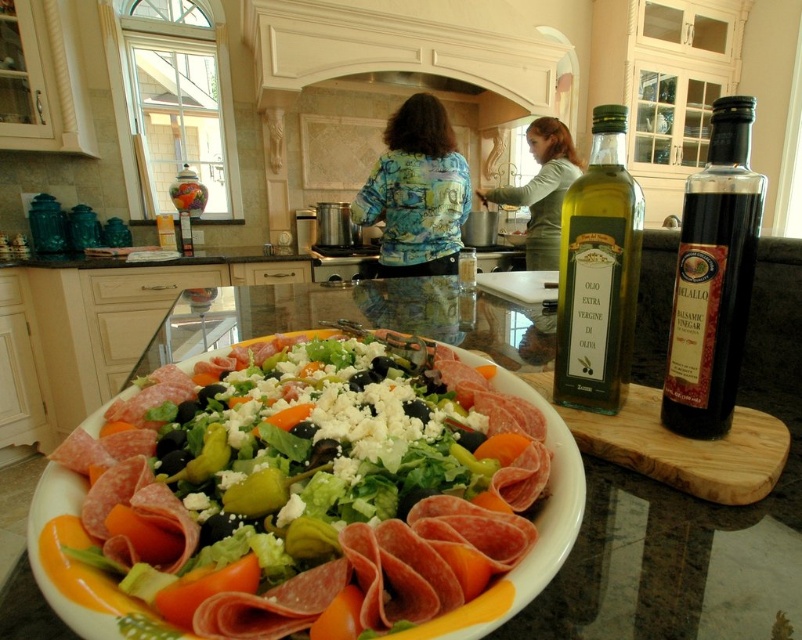
Question: Which is farther from the floral-patterned shirt at center?

Choices:
 (A) green fabric shirt at center
 (B) green glass bottle at center

Answer: (B)

Question: Which of the following is the farthest from the observer?

Choices:
 (A) (756, 225)
 (B) (410, 198)
 (C) (663, 362)
 (D) (480, 198)

Answer: (D)

Question: From the image, what is the correct spatial relationship of marble at center in relation to dark glass bottle at right?

Choices:
 (A) above
 (B) below

Answer: (B)

Question: Is salmon pink cured meat at center behind floral-patterned shirt at center?

Choices:
 (A) no
 (B) yes

Answer: (A)

Question: Can you confirm if dark glass bottle at right is smaller than green glass bottle at center?

Choices:
 (A) yes
 (B) no

Answer: (B)

Question: Based on their relative distances, which object is farther from the dark glass bottle at right?

Choices:
 (A) floral-patterned shirt at center
 (B) marble at center
 (C) salmon pink cured meat at center
 (D) green fabric shirt at center

Answer: (D)